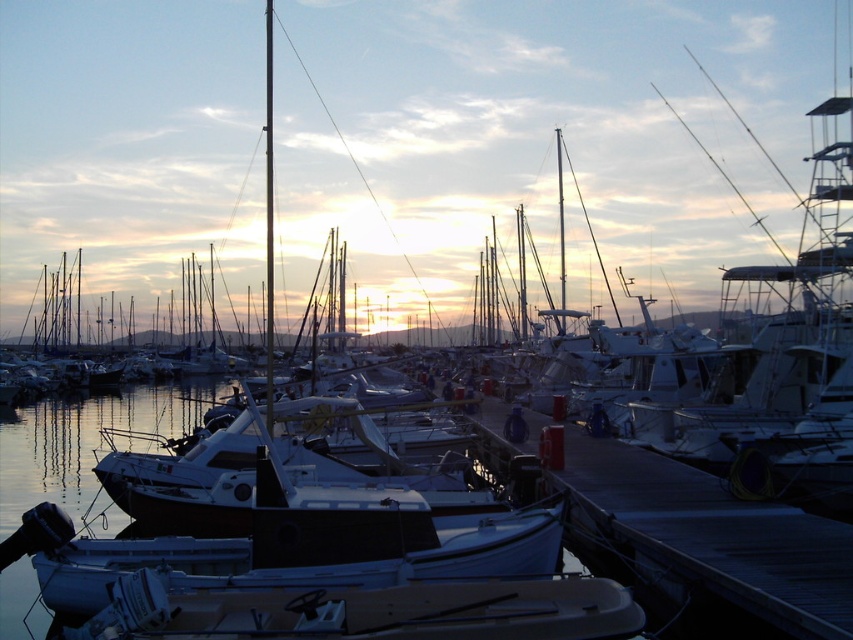
Is smooth wood dock at center to the left of white matte boat at center from the viewer's perspective?

Incorrect, smooth wood dock at center is not on the left side of white matte boat at center.

Who is positioned more to the left, smooth wood dock at center or white matte boat at center?

Positioned to the left is white matte boat at center.

Between point (646, 556) and point (83, 605), which one is positioned in front?

Point (83, 605)

Where is `smooth wood dock at center`? This screenshot has height=640, width=853. smooth wood dock at center is located at coordinates (701, 547).

In the scene shown: Is smooth wood dock at center closer to camera compared to white matte boat at lower center?

That is True.

Is point (729, 602) less distant than point (582, 592)?

Yes, point (729, 602) is closer to viewer.

Who is more forward, [809,566] or [439,589]?

Point [439,589]

Locate an element on the screen. This screenshot has height=640, width=853. smooth wood dock at center is located at coordinates (701, 547).

Does white matte boat at lower center have a greater height compared to white matte boat at center?

No, white matte boat at lower center is not taller than white matte boat at center.

In the scene shown: Is white matte boat at lower center bigger than white matte boat at center?

Correct, white matte boat at lower center is larger in size than white matte boat at center.

Is point (254, 632) in front of point (422, 557)?

That is True.

Locate an element on the screen. This screenshot has height=640, width=853. white matte boat at lower center is located at coordinates (369, 611).